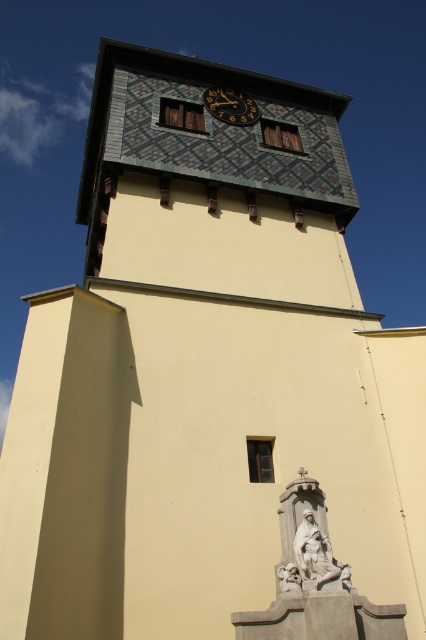
Does white marble statue at lower center have a greater width compared to gold metallic clock at upper center?

In fact, white marble statue at lower center might be narrower than gold metallic clock at upper center.

Is white marble statue at lower center bigger than gold metallic clock at upper center?

Actually, white marble statue at lower center might be smaller than gold metallic clock at upper center.

Image resolution: width=426 pixels, height=640 pixels. What do you see at coordinates (311, 557) in the screenshot?
I see `white marble statue at lower center` at bounding box center [311, 557].

Find the location of a particular element. white marble statue at lower center is located at coordinates (311, 557).